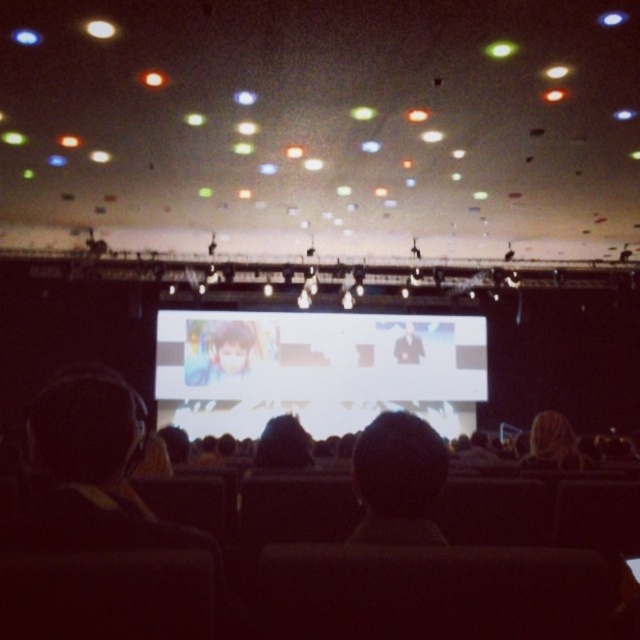
You are an attendee at this event and want to get a better view of the smooth black hair at center. Since the smooth skin portrait at center is blocking your view, can you move to the left or right to see around it?

The smooth black hair at center is behind the smooth skin portrait at center, so moving to either the left or right might allow you to see around the smooth skin portrait at center and get a better view of the smooth black hair at center.

Consider the image. Based on the scene description, what is located at the coordinates point (218, 349)?

The smooth skin portrait at center is located at point (218, 349).

You are an event photographer trying to capture a clear photo of both characters on the large screen. The smooth brown hair at center and the smooth black hair at center are both important. Since the screen is bright, you want to adjust your camera settings to ensure both are visible. Considering their widths, which character might require more careful framing to avoid being cut off?

The smooth brown hair at center is wider than the smooth black hair at center, so the smooth brown hair at center might require more careful framing to avoid being cut off.